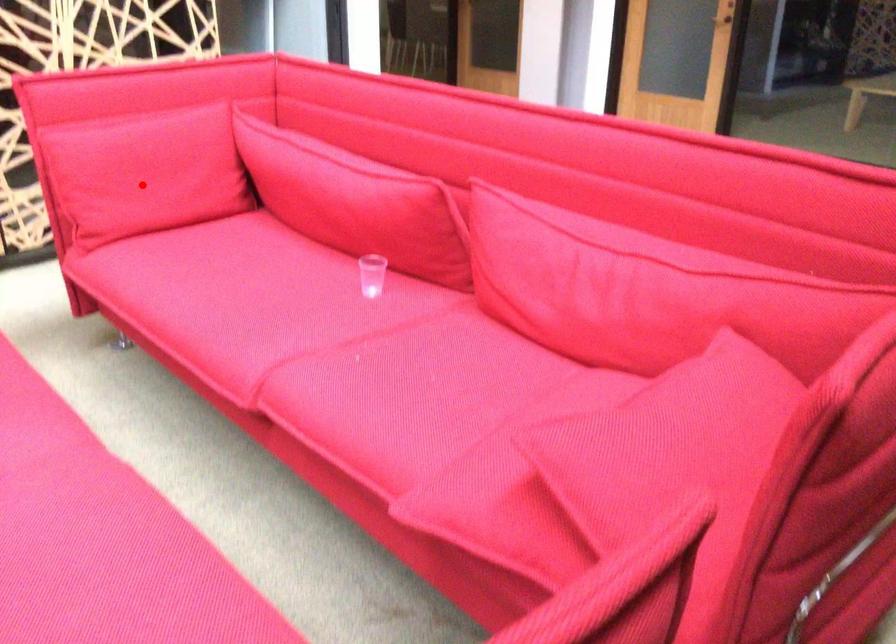
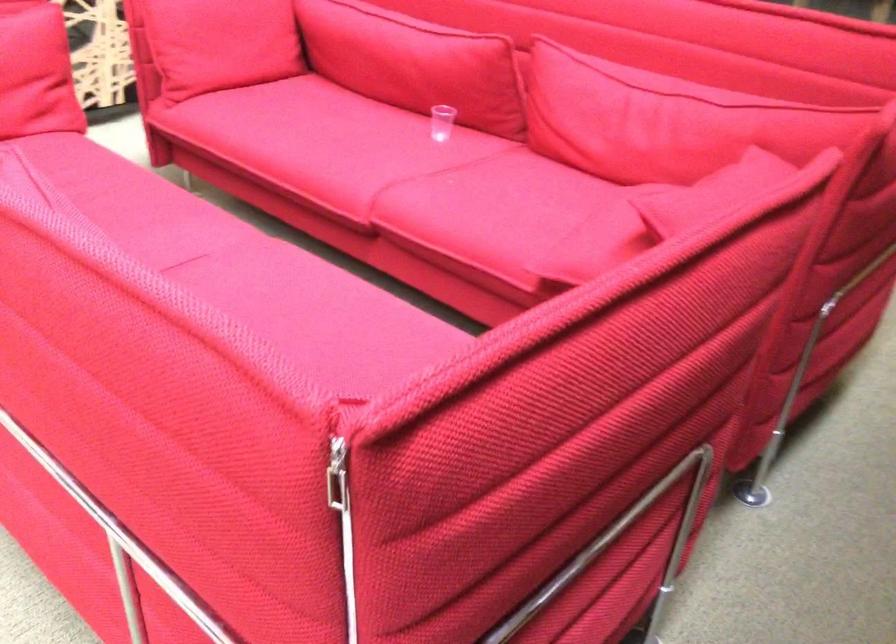
Where in the second image is the point corresponding to the highlighted location from the first image?

(220, 43)